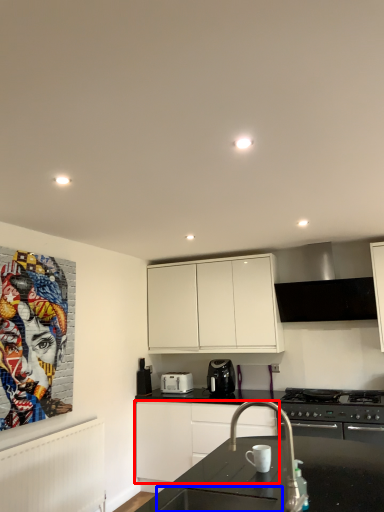
Question: Which object appears farthest to the camera in this image, cabinetry (highlighted by a red box) or sink (highlighted by a blue box)?

Choices:
 (A) cabinetry
 (B) sink

Answer: (A)